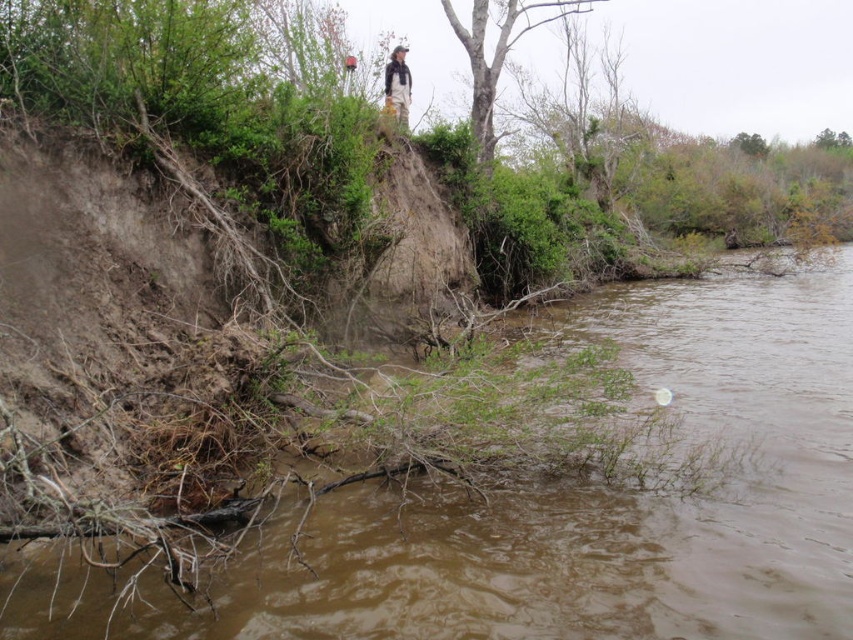
Question: Which point appears farthest from the camera in this image?

Choices:
 (A) click(x=527, y=4)
 (B) click(x=392, y=588)

Answer: (A)

Question: Is brown muddy water at lower left wider than khaki pants at upper center?

Choices:
 (A) no
 (B) yes

Answer: (B)

Question: Which of the following is the farthest from the observer?

Choices:
 (A) (396, 72)
 (B) (564, 6)

Answer: (B)

Question: Which point is farther from the camera taking this photo?

Choices:
 (A) (772, 557)
 (B) (474, 19)

Answer: (B)

Question: Does brown muddy water at lower left appear under smooth bark tree at upper center?

Choices:
 (A) yes
 (B) no

Answer: (A)

Question: Is brown muddy water at lower left closer to camera compared to khaki pants at upper center?

Choices:
 (A) no
 (B) yes

Answer: (B)